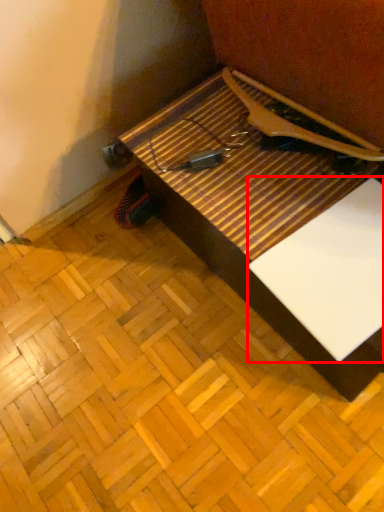
Question: From the image, what is the correct spatial relationship of wide (annotated by the red box) in relation to table?

Choices:
 (A) left
 (B) right

Answer: (B)